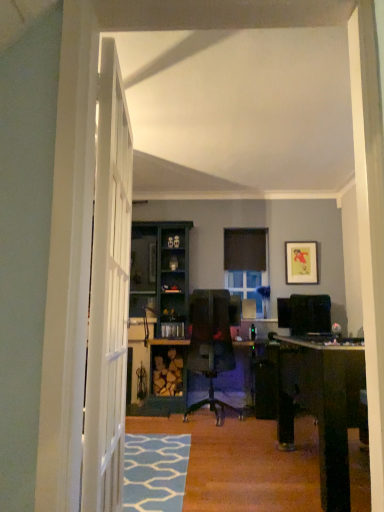
Question: Choose the correct answer: Is yellow paper picture frame at upper right inside clear glass window at center or outside it?

Choices:
 (A) inside
 (B) outside

Answer: (B)

Question: Considering the positions of point (309, 284) and point (228, 279), is point (309, 284) closer or farther from the camera than point (228, 279)?

Choices:
 (A) farther
 (B) closer

Answer: (B)

Question: Which object is the farthest from the clear glass window at center?

Choices:
 (A) yellow paper picture frame at upper right
 (B) black matte curtain at center

Answer: (A)

Question: Which object is the closest to the black matte curtain at center?

Choices:
 (A) clear glass window at center
 (B) yellow paper picture frame at upper right

Answer: (A)